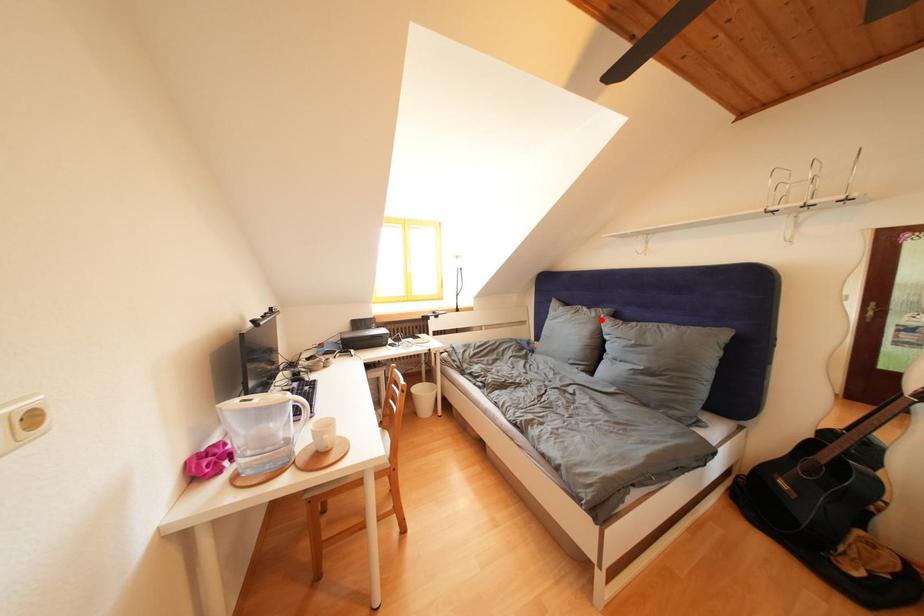
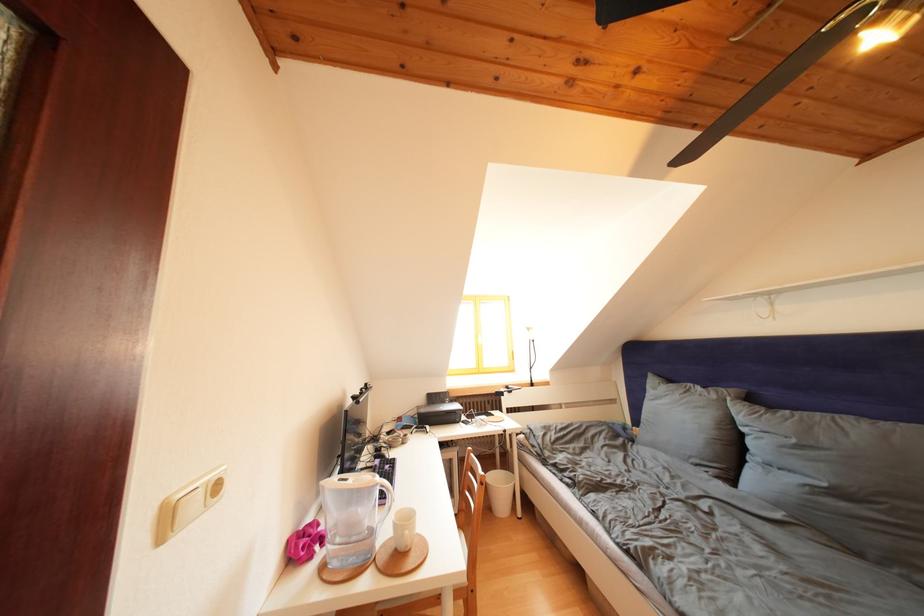
Where in the second image is the point corresponding to the highlighted location from the first image?

(722, 402)